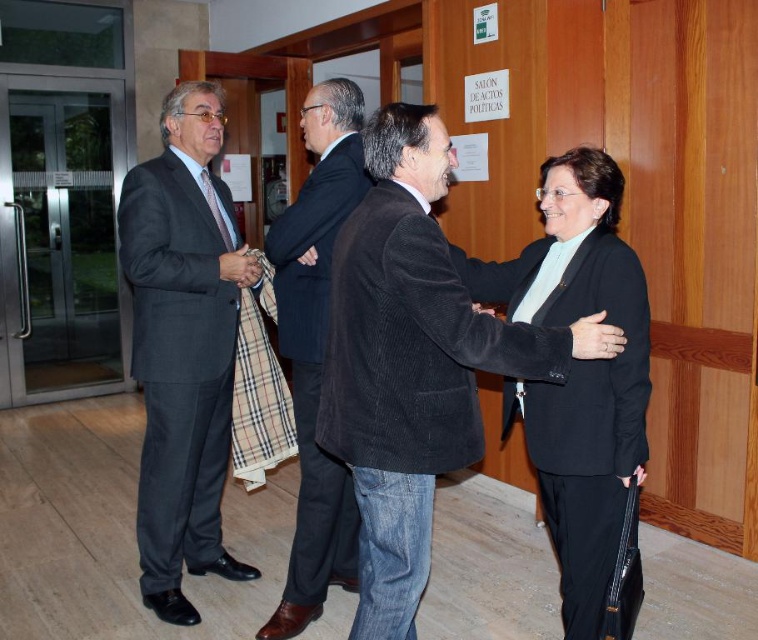
Question: Which of the following is the closest to the observer?

Choices:
 (A) (572, 324)
 (B) (196, 227)
 (C) (279, 324)

Answer: (A)

Question: Is dark corduroy blazer at center in front of black matte blazer at center?

Choices:
 (A) yes
 (B) no

Answer: (A)

Question: Which of these objects is positioned farthest from the dark gray suit at left?

Choices:
 (A) dark corduroy blazer at center
 (B) dark brown corduroy blazer at center

Answer: (A)

Question: Does black matte blazer at center appear under matte black hand at upper right?

Choices:
 (A) no
 (B) yes

Answer: (B)

Question: Which object is positioned farthest from the matte black hand at upper right?

Choices:
 (A) black matte blazer at center
 (B) dark gray suit at left
 (C) dark brown corduroy blazer at center

Answer: (B)

Question: Observing the image, what is the correct spatial positioning of dark corduroy blazer at center in reference to dark gray suit at left?

Choices:
 (A) left
 (B) right

Answer: (B)